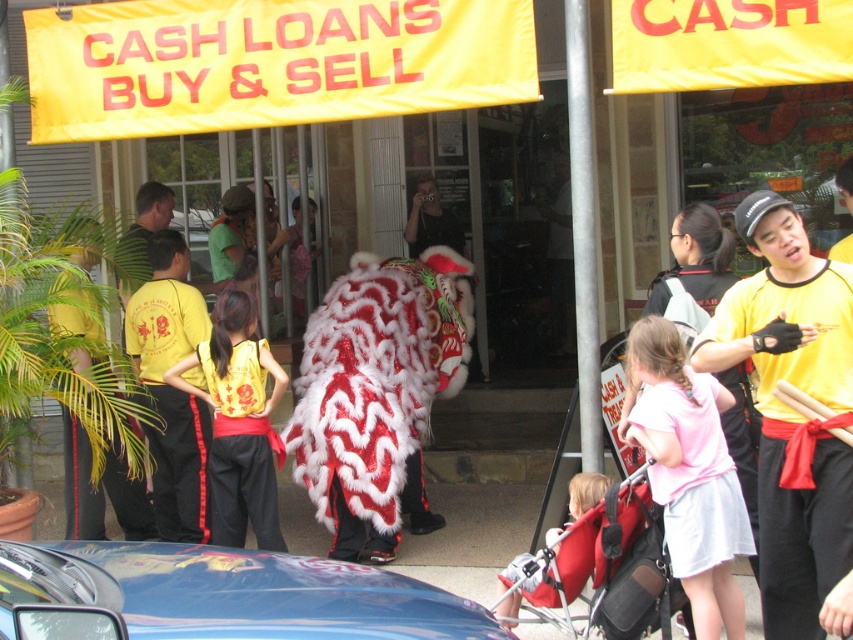
You are standing in front of the store and want to take a photo of the lion dance performer. There are two points marked on the ground where you can stand. The first point is at position point (68, 80) and the second is at point (285, 596). Which point should you choose to be closer to the lion dance performer?

You should choose point (68, 80) because it is further to the camera than point (285, 596), meaning it is closer to the lion dance performer.

You are standing in front of the store and want to take a photo of the lion dance performer. The camera you have can only focus on objects within 5 meters. Is the point at coordinates point (x=164, y=58) within the camera focus range?

The point point (x=164, y=58) is 5.12 meters from the camera, which is just beyond the 5 meter focus range. The camera cannot focus on it.

In the scene shown: You are a photographer at the event and want to capture both the pink fabric dress at center and the yellow fabric pants at left in a single shot. Based on their positions, which one should you focus on first to ensure both are in frame?

The pink fabric dress at center is below the yellow fabric pants at left, so you should focus on the yellow fabric pants at left first to ensure both are in frame.